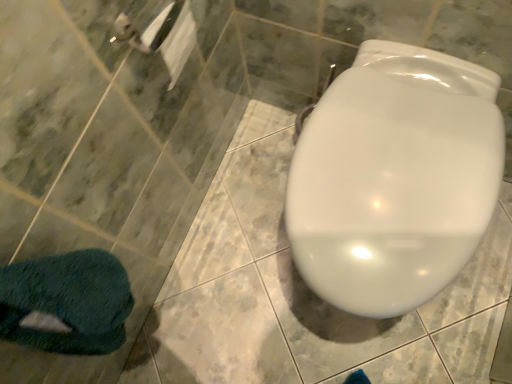
The image size is (512, 384). In order to click on white glossy toilet at center in this screenshot , I will do `click(395, 178)`.

The image size is (512, 384). What do you see at coordinates (395, 178) in the screenshot? I see `white glossy toilet at center` at bounding box center [395, 178].

The height and width of the screenshot is (384, 512). Find the location of `white glossy toilet at center`. white glossy toilet at center is located at coordinates (395, 178).